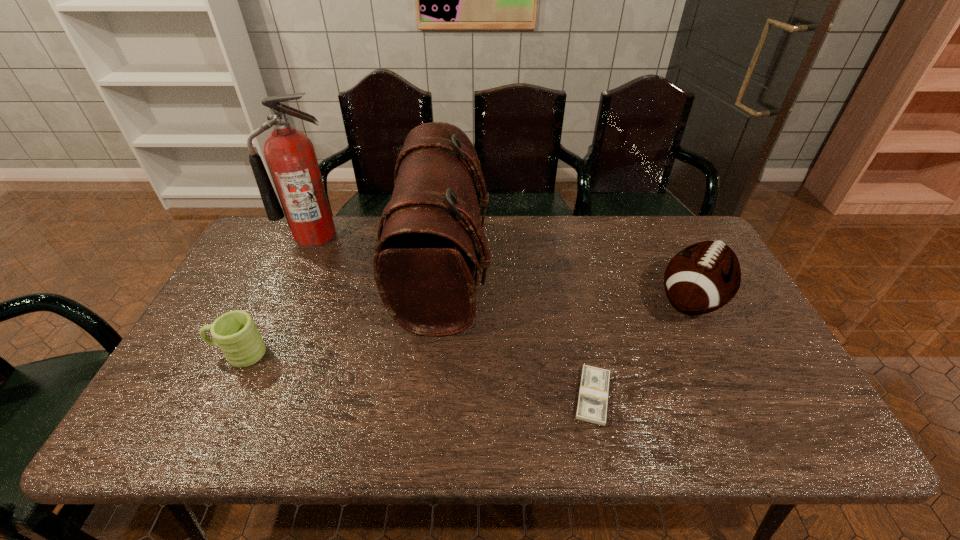
Where is `free point between the fire extinguisher and the second shortest object`? The height and width of the screenshot is (540, 960). free point between the fire extinguisher and the second shortest object is located at coordinates (276, 294).

Where is `free space between the third tallest object and the dollar`? free space between the third tallest object and the dollar is located at coordinates (642, 348).

The image size is (960, 540). What are the coordinates of `free space between the second object from right to left and the mug` in the screenshot? It's located at (416, 375).

Where is `free space between the second shortest object and the tallest object`? This screenshot has width=960, height=540. free space between the second shortest object and the tallest object is located at coordinates (276, 294).

Identify which object is the nearest to the rightmost object. Please provide its 2D coordinates. Your answer should be formatted as a tuple, i.e. [(x, y)], where the tuple contains the x and y coordinates of a point satisfying the conditions above.

[(593, 394)]

You are a GUI agent. You are given a task and a screenshot of the screen. Output one action in this format:
    pyautogui.click(x=<x>, y=<y>)
    Task: Click on the closest object to the rightmost object
    Image resolution: width=960 pixels, height=540 pixels.
    Given the screenshot: What is the action you would take?
    pyautogui.click(x=593, y=394)

Where is `free spot that satisfies the following two spatial constraints: 1. on the side of the mug with the handle; 2. on the left side of the second object from right to left`? free spot that satisfies the following two spatial constraints: 1. on the side of the mug with the handle; 2. on the left side of the second object from right to left is located at coordinates (218, 396).

Identify the location of free location that satisfies the following two spatial constraints: 1. on the front of the fire extinguisher near the operation label; 2. on the side of the mug with the handle. (262, 353).

Locate an element on the screen. Image resolution: width=960 pixels, height=540 pixels. free point that satisfies the following two spatial constraints: 1. on the front of the fire extinguisher near the operation label; 2. on the left side of the rightmost object is located at coordinates (285, 301).

Locate an element on the screen. This screenshot has width=960, height=540. free space in the image that satisfies the following two spatial constraints: 1. on the front side of the rightmost object; 2. on the side of the fourth tallest object with the handle is located at coordinates (717, 353).